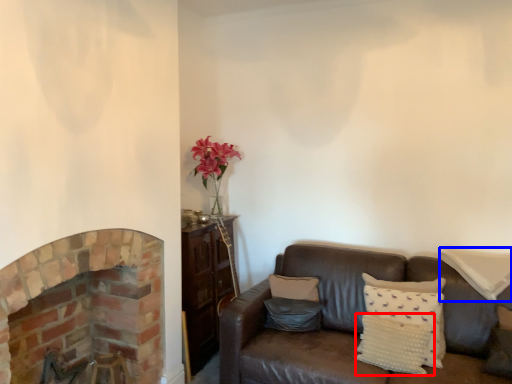
Question: Which of the following is the farthest to the observer, pillow (highlighted by a red box) or pillow (highlighted by a blue box)?

Choices:
 (A) pillow
 (B) pillow

Answer: (B)